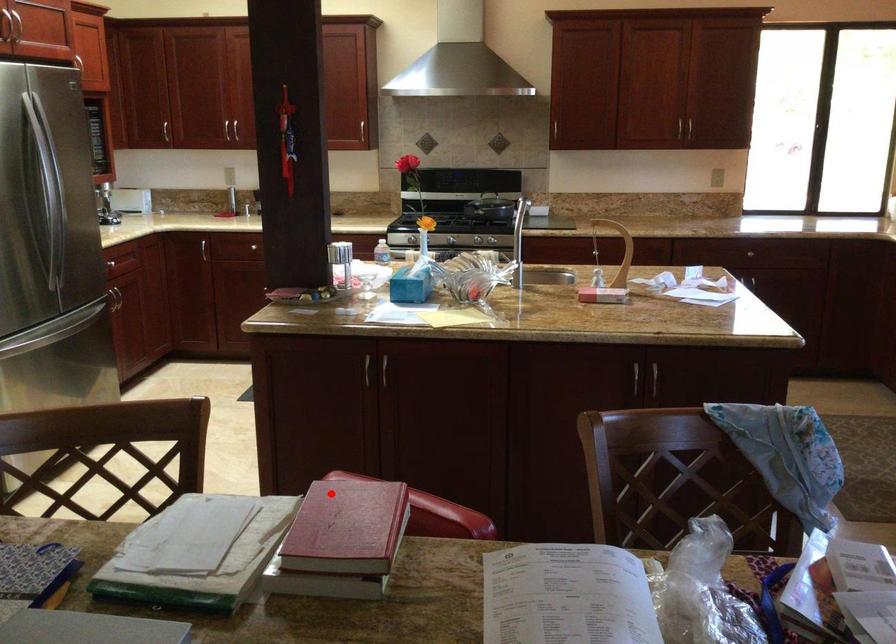
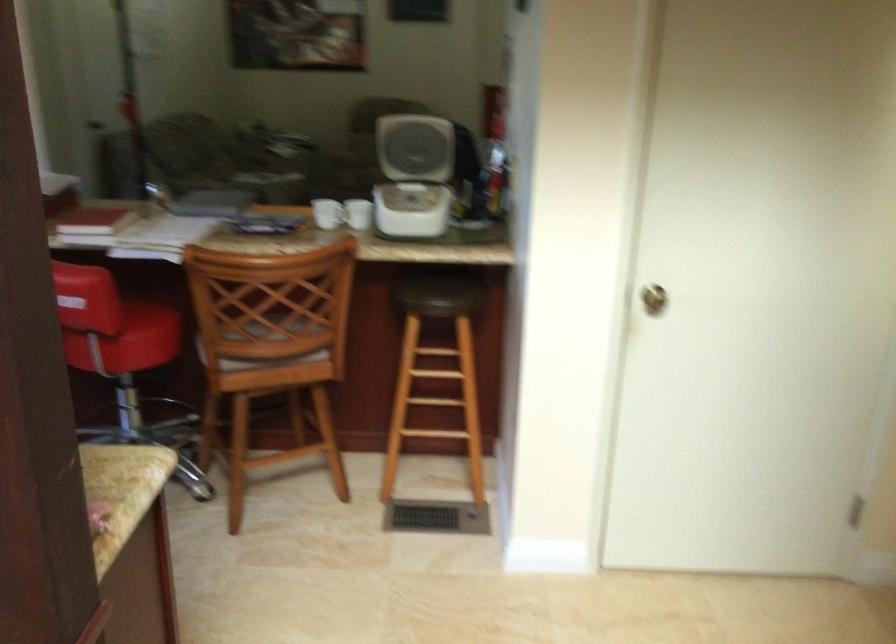
Question: I am providing you with two images of the same scene from different viewpoints. A red point is shown in image1. For the corresponding object point in image2, is it positioned nearer or farther from the camera?

Choices:
 (A) Nearer
 (B) Farther

Answer: (B)